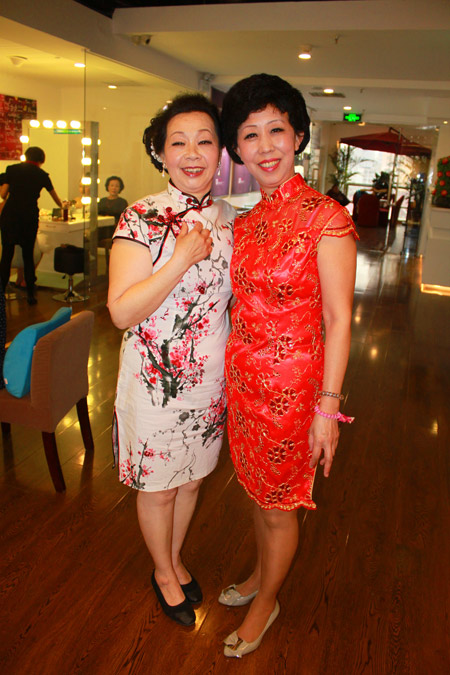
In order to click on green lighted sign in this screenshot , I will do `click(350, 115)`.